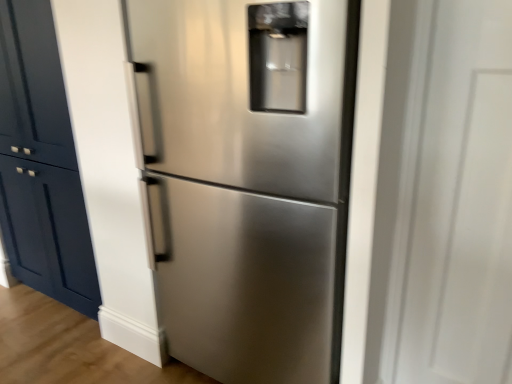
Question: Is transparent glass door at right outside of matte navy blue cabinet at left?

Choices:
 (A) no
 (B) yes

Answer: (B)

Question: Considering the relative sizes of transparent glass door at right and matte navy blue cabinet at left in the image provided, is transparent glass door at right bigger than matte navy blue cabinet at left?

Choices:
 (A) no
 (B) yes

Answer: (A)

Question: Considering the relative sizes of transparent glass door at right and matte navy blue cabinet at left in the image provided, is transparent glass door at right wider than matte navy blue cabinet at left?

Choices:
 (A) no
 (B) yes

Answer: (B)

Question: From a real-world perspective, is transparent glass door at right positioned under matte navy blue cabinet at left based on gravity?

Choices:
 (A) yes
 (B) no

Answer: (B)

Question: Does transparent glass door at right have a lesser height compared to matte navy blue cabinet at left?

Choices:
 (A) yes
 (B) no

Answer: (A)

Question: From the image's perspective, is matte navy blue cabinet at left above or below transparent glass door at right?

Choices:
 (A) below
 (B) above

Answer: (B)

Question: Considering the positions of matte navy blue cabinet at left and transparent glass door at right in the image, is matte navy blue cabinet at left taller or shorter than transparent glass door at right?

Choices:
 (A) tall
 (B) short

Answer: (A)

Question: Is matte navy blue cabinet at left spatially inside transparent glass door at right, or outside of it?

Choices:
 (A) outside
 (B) inside

Answer: (A)

Question: Looking at their shapes, would you say matte navy blue cabinet at left is wider or thinner than transparent glass door at right?

Choices:
 (A) wide
 (B) thin

Answer: (B)

Question: Is matte navy blue cabinet at left bigger or smaller than stainless steel refrigerator at center?

Choices:
 (A) big
 (B) small

Answer: (B)

Question: Is point (29, 193) positioned closer to the camera than point (246, 327)?

Choices:
 (A) farther
 (B) closer

Answer: (A)

Question: Considering the positions of matte navy blue cabinet at left and stainless steel refrigerator at center in the image, is matte navy blue cabinet at left wider or thinner than stainless steel refrigerator at center?

Choices:
 (A) thin
 (B) wide

Answer: (A)

Question: From the image's perspective, is matte navy blue cabinet at left located above or below stainless steel refrigerator at center?

Choices:
 (A) above
 (B) below

Answer: (A)

Question: Considering the positions of transparent glass door at right and matte navy blue cabinet at left in the image, is transparent glass door at right bigger or smaller than matte navy blue cabinet at left?

Choices:
 (A) big
 (B) small

Answer: (B)

Question: Does point (415, 51) appear closer or farther from the camera than point (57, 71)?

Choices:
 (A) closer
 (B) farther

Answer: (A)